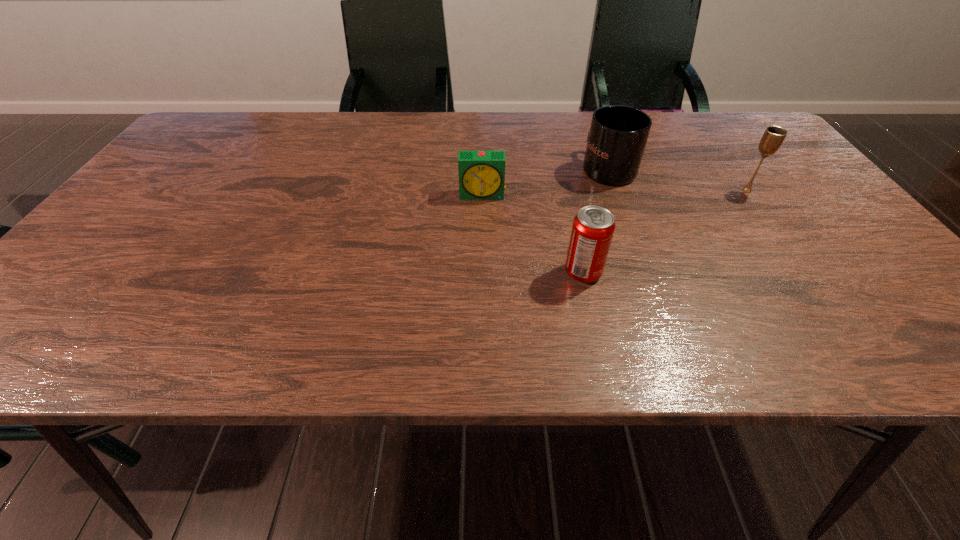
Where is `free spot located on the left of the nearest object`? This screenshot has width=960, height=540. free spot located on the left of the nearest object is located at coordinates (494, 272).

This screenshot has width=960, height=540. Find the location of `vacant space located on the front-facing side of the shortest object`. vacant space located on the front-facing side of the shortest object is located at coordinates (484, 319).

Where is `object that is at the far edge`? Image resolution: width=960 pixels, height=540 pixels. object that is at the far edge is located at coordinates (618, 135).

Find the location of a particular element. object that is at the right edge is located at coordinates (773, 137).

Locate an element on the screen. vacant position at the far edge of the desktop is located at coordinates (289, 134).

Where is `free space at the near edge`? Image resolution: width=960 pixels, height=540 pixels. free space at the near edge is located at coordinates (464, 320).

Find the location of `free space at the left edge`. free space at the left edge is located at coordinates (169, 164).

In the image, there is a desktop. In order to click on blank space at the right edge in this screenshot , I will do `click(746, 167)`.

Locate an element on the screen. This screenshot has height=540, width=960. vacant space at the far left corner of the desktop is located at coordinates (204, 123).

Where is `vacant space at the far right corner of the desktop`? This screenshot has width=960, height=540. vacant space at the far right corner of the desktop is located at coordinates tap(730, 152).